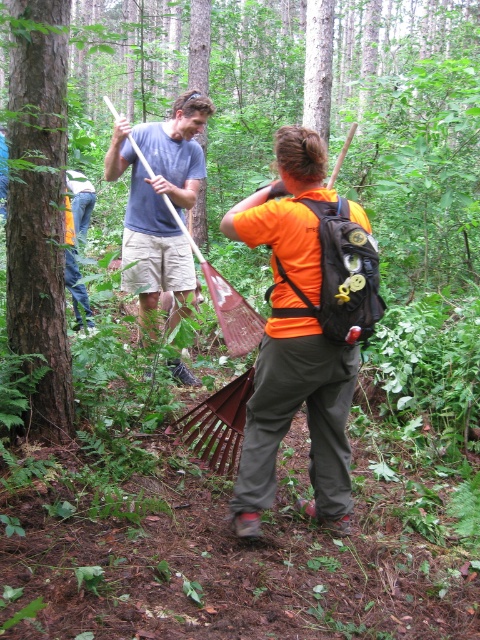
Does brown rough tree trunk at center-left have a larger size compared to matte blue shirt at upper center?

Correct, brown rough tree trunk at center-left is larger in size than matte blue shirt at upper center.

Is point (467, 0) positioned in front of point (152, 273)?

No, it is behind (152, 273).

Where is `brown rough tree trunk at center-left`? The width and height of the screenshot is (480, 640). brown rough tree trunk at center-left is located at coordinates (411, 132).

What do you see at coordinates (38, 205) in the screenshot? I see `brown rough tree trunk at center` at bounding box center [38, 205].

The height and width of the screenshot is (640, 480). What are the coordinates of `brown rough tree trunk at center` in the screenshot? It's located at (38, 205).

Does metallic rake at center appear under brown rough tree trunk at center?

Indeed, metallic rake at center is positioned under brown rough tree trunk at center.

Is metallic rake at center further to the viewer compared to brown rough tree trunk at center?

Yes, it is.

Does point (322, 513) come in front of point (45, 412)?

That is True.

Where is `metallic rake at center`? metallic rake at center is located at coordinates (295, 342).